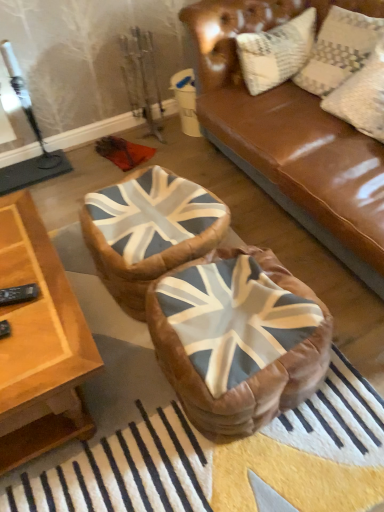
In order to face leather bean bag at center, positioned as the 2th bean bag chair in back-to-front order, should I rotate leftwards or rightwards?

You should look right and rotate roughly 6.542 degrees.

Describe the element at coordinates (341, 46) in the screenshot. Image resolution: width=384 pixels, height=512 pixels. I see `textured cream pillow at upper right` at that location.

Identify the location of wooden table at lower left. Image resolution: width=384 pixels, height=512 pixels. (39, 343).

From the image's perspective, which is below, leather union jack bean bag at center, the 1th bean bag chair viewed from the back, or wooden table at lower left?

From the image's view, wooden table at lower left is below.

Is leather union jack bean bag at center, the 1th bean bag chair viewed from the back, taller than wooden table at lower left?

Incorrect, the height of leather union jack bean bag at center, the 1th bean bag chair viewed from the back, is not larger of that of wooden table at lower left.

Between leather union jack bean bag at center, the 1th bean bag chair viewed from the back, and wooden table at lower left, which one has smaller width?

Thinner between the two is leather union jack bean bag at center, the 1th bean bag chair viewed from the back.

In terms of size, does textured cream pillow at upper right appear bigger or smaller than leather bean bag at center, acting as the first bean bag chair starting from the front?

textured cream pillow at upper right is smaller than leather bean bag at center, acting as the first bean bag chair starting from the front.

Considering the relative positions of textured cream pillow at upper right and leather bean bag at center, acting as the first bean bag chair starting from the front, in the image provided, is textured cream pillow at upper right behind leather bean bag at center, acting as the first bean bag chair starting from the front,?

Yes, textured cream pillow at upper right is further from the viewer.

Would you say textured cream pillow at upper right is outside leather bean bag at center, acting as the first bean bag chair starting from the front?

Yes, textured cream pillow at upper right is not within leather bean bag at center, acting as the first bean bag chair starting from the front.

Can you confirm if textured cream pillow at upper right is positioned to the left of leather bean bag at center, acting as the first bean bag chair starting from the front?

In fact, textured cream pillow at upper right is to the right of leather bean bag at center, acting as the first bean bag chair starting from the front.

In the image, is textured cream pillow at upper right on the left side or the right side of leather union jack bean bag at center, the 1th bean bag chair viewed from the back?

textured cream pillow at upper right is positioned on leather union jack bean bag at center, the 1th bean bag chair viewed from the back,'s right side.

Consider the image. From a real-world perspective, relative to leather union jack bean bag at center, the 1th bean bag chair viewed from the back, is textured cream pillow at upper right vertically above or below?

From a real-world perspective, textured cream pillow at upper right is physically above leather union jack bean bag at center, the 1th bean bag chair viewed from the back.

Which object is more forward, textured cream pillow at upper right or leather union jack bean bag at center, the 1th bean bag chair viewed from the back?

leather union jack bean bag at center, the 1th bean bag chair viewed from the back.

Which of these two, textured cream pillow at upper right or leather union jack bean bag at center, the 1th bean bag chair viewed from the back, stands shorter?

leather union jack bean bag at center, the 1th bean bag chair viewed from the back.

Consider the image. What's the angular difference between leather union jack bean bag at center, which is the second bean bag chair in front-to-back order, and leather bean bag at center, positioned as the 2th bean bag chair in back-to-front order,'s facing directions?

6.73 degrees separate the facing orientations of leather union jack bean bag at center, which is the second bean bag chair in front-to-back order, and leather bean bag at center, positioned as the 2th bean bag chair in back-to-front order.

Is leather union jack bean bag at center, which is the second bean bag chair in front-to-back order, placed right next to leather bean bag at center, positioned as the 2th bean bag chair in back-to-front order?

leather union jack bean bag at center, which is the second bean bag chair in front-to-back order, and leather bean bag at center, positioned as the 2th bean bag chair in back-to-front order, are not in contact.

Is point (95, 194) closer or farther from the camera than point (279, 282)?

Clearly, point (95, 194) is more distant from the camera than point (279, 282).

Considering the relative positions of leather union jack bean bag at center, which is the second bean bag chair in front-to-back order, and leather bean bag at center, positioned as the 2th bean bag chair in back-to-front order, in the image provided, is leather union jack bean bag at center, which is the second bean bag chair in front-to-back order, in front of leather bean bag at center, positioned as the 2th bean bag chair in back-to-front order,?

No, leather union jack bean bag at center, which is the second bean bag chair in front-to-back order, is behind leather bean bag at center, positioned as the 2th bean bag chair in back-to-front order.

Does leather bean bag at center, acting as the first bean bag chair starting from the front, turn towards textured cream pillow at upper right?

No.

You are a GUI agent. You are given a task and a screenshot of the screen. Output one action in this format:
    pyautogui.click(x=<x>, y=<y>)
    Task: Click on the bean bag chair that is the 2nd object located below the textured cream pillow at upper right (from the image's perspective)
    This screenshot has width=384, height=512.
    Given the screenshot: What is the action you would take?
    pyautogui.click(x=238, y=339)

From the image's perspective, between leather bean bag at center, positioned as the 2th bean bag chair in back-to-front order, and textured cream pillow at upper right, which one is located above?

textured cream pillow at upper right.

Considering the relative positions of wooden table at lower left and leather union jack bean bag at center, the 1th bean bag chair viewed from the back, in the image provided, is wooden table at lower left to the left of leather union jack bean bag at center, the 1th bean bag chair viewed from the back, from the viewer's perspective?

Indeed, wooden table at lower left is positioned on the left side of leather union jack bean bag at center, the 1th bean bag chair viewed from the back.

Based on the photo, is wooden table at lower left in front of or behind leather union jack bean bag at center, the 1th bean bag chair viewed from the back, in the image?

wooden table at lower left is positioned closer to the viewer than leather union jack bean bag at center, the 1th bean bag chair viewed from the back.

Is wooden table at lower left positioned with its back to leather union jack bean bag at center, the 1th bean bag chair viewed from the back?

wooden table at lower left is not turned away from leather union jack bean bag at center, the 1th bean bag chair viewed from the back.

Is wooden table at lower left spatially inside leather union jack bean bag at center, which is the second bean bag chair in front-to-back order, or outside of it?

wooden table at lower left is not inside leather union jack bean bag at center, which is the second bean bag chair in front-to-back order, it's outside.

Does leather union jack bean bag at center, which is the second bean bag chair in front-to-back order, appear on the left side of textured cream pillow at upper right?

Yes.

Can you confirm if leather union jack bean bag at center, which is the second bean bag chair in front-to-back order, is smaller than textured cream pillow at upper right?

No, leather union jack bean bag at center, which is the second bean bag chair in front-to-back order, is not smaller than textured cream pillow at upper right.

Does leather union jack bean bag at center, which is the second bean bag chair in front-to-back order, have a lesser height compared to textured cream pillow at upper right?

Yes, leather union jack bean bag at center, which is the second bean bag chair in front-to-back order, is shorter than textured cream pillow at upper right.

Identify the location of bean bag chair above the wooden table at lower left (from the image's perspective). Image resolution: width=384 pixels, height=512 pixels. (149, 231).

This screenshot has width=384, height=512. Find the location of `bean bag chair that is the 2nd object located in front of the textured cream pillow at upper right`. bean bag chair that is the 2nd object located in front of the textured cream pillow at upper right is located at coordinates (238, 339).

Estimate the real-world distances between objects in this image. Which object is closer to textured cream pillow at upper right, leather union jack bean bag at center, the 1th bean bag chair viewed from the back, or leather bean bag at center, acting as the first bean bag chair starting from the front?

leather union jack bean bag at center, the 1th bean bag chair viewed from the back, lies closer to textured cream pillow at upper right than the other object.

Based on the photo, when comparing their distances from leather union jack bean bag at center, which is the second bean bag chair in front-to-back order, does textured cream pillow at upper right or leather bean bag at center, positioned as the 2th bean bag chair in back-to-front order, seem further?

textured cream pillow at upper right is further to leather union jack bean bag at center, which is the second bean bag chair in front-to-back order.

Considering their positions, is leather bean bag at center, positioned as the 2th bean bag chair in back-to-front order, positioned closer to textured cream pillow at upper right than leather union jack bean bag at center, which is the second bean bag chair in front-to-back order?

Based on the image, leather union jack bean bag at center, which is the second bean bag chair in front-to-back order, appears to be nearer to textured cream pillow at upper right.

Which object lies nearer to the anchor point leather bean bag at center, acting as the first bean bag chair starting from the front, textured cream pillow at upper right or wooden table at lower left?

wooden table at lower left is positioned closer to the anchor leather bean bag at center, acting as the first bean bag chair starting from the front.

From the image, which object appears to be nearer to wooden table at lower left, textured cream pillow at upper right or leather bean bag at center, acting as the first bean bag chair starting from the front?

The object closer to wooden table at lower left is leather bean bag at center, acting as the first bean bag chair starting from the front.

Considering their positions, is leather union jack bean bag at center, which is the second bean bag chair in front-to-back order, positioned further to wooden table at lower left than textured cream pillow at upper right?

A: Based on the image, textured cream pillow at upper right appears to be further to wooden table at lower left.

From the image, which object appears to be farther from leather bean bag at center, positioned as the 2th bean bag chair in back-to-front order, wooden table at lower left or leather union jack bean bag at center, which is the second bean bag chair in front-to-back order?

The object further to leather bean bag at center, positioned as the 2th bean bag chair in back-to-front order, is wooden table at lower left.

Based on their spatial positions, is wooden table at lower left or leather bean bag at center, positioned as the 2th bean bag chair in back-to-front order, further from textured cream pillow at upper right?

Based on the image, wooden table at lower left appears to be further to textured cream pillow at upper right.

Find the location of `bean bag chair between wooden table at lower left and leather bean bag at center, positioned as the 2th bean bag chair in back-to-front order, in the horizontal direction`. bean bag chair between wooden table at lower left and leather bean bag at center, positioned as the 2th bean bag chair in back-to-front order, in the horizontal direction is located at coordinates (149, 231).

You are a GUI agent. You are given a task and a screenshot of the screen. Output one action in this format:
    pyautogui.click(x=<x>, y=<y>)
    Task: Click on the table that lies between textured cream pillow at upper right and leather bean bag at center, acting as the first bean bag chair starting from the front, from top to bottom
    The height and width of the screenshot is (512, 384).
    Given the screenshot: What is the action you would take?
    click(39, 343)

You are a GUI agent. You are given a task and a screenshot of the screen. Output one action in this format:
    pyautogui.click(x=<x>, y=<y>)
    Task: Click on the bean bag chair between textured cream pillow at upper right and leather bean bag at center, acting as the first bean bag chair starting from the front, in the up-down direction
    The image size is (384, 512).
    Given the screenshot: What is the action you would take?
    pyautogui.click(x=149, y=231)